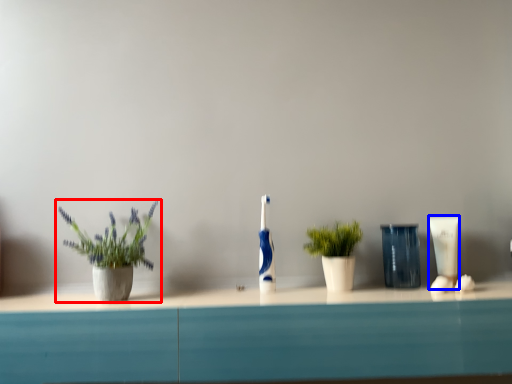
Question: Which object is further to the camera taking this photo, houseplant (highlighted by a red box) or toiletry (highlighted by a blue box)?

Choices:
 (A) houseplant
 (B) toiletry

Answer: (B)